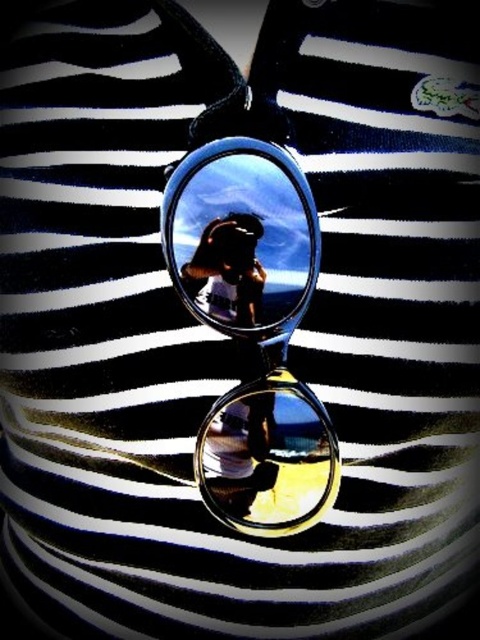
Question: Which object appears farthest from the camera in this image?

Choices:
 (A) metallic silver phone at center
 (B) clear glass lens at center
 (C) clear plastic goggles at center

Answer: (B)

Question: Considering the relative positions of clear plastic goggles at center and clear glass lens at center in the image provided, where is clear plastic goggles at center located with respect to clear glass lens at center?

Choices:
 (A) right
 (B) left

Answer: (B)

Question: Is clear plastic goggles at center further to the viewer compared to metallic silver phone at center?

Choices:
 (A) yes
 (B) no

Answer: (B)

Question: Can you confirm if clear glass lens at center is thinner than metallic silver phone at center?

Choices:
 (A) yes
 (B) no

Answer: (B)

Question: Which of the following is the closest to the observer?

Choices:
 (A) (304, 276)
 (B) (207, 285)
 (C) (240, 477)

Answer: (A)

Question: Which object appears farthest from the camera in this image?

Choices:
 (A) metallic silver phone at center
 (B) clear glass lens at center
 (C) clear plastic goggles at center

Answer: (B)